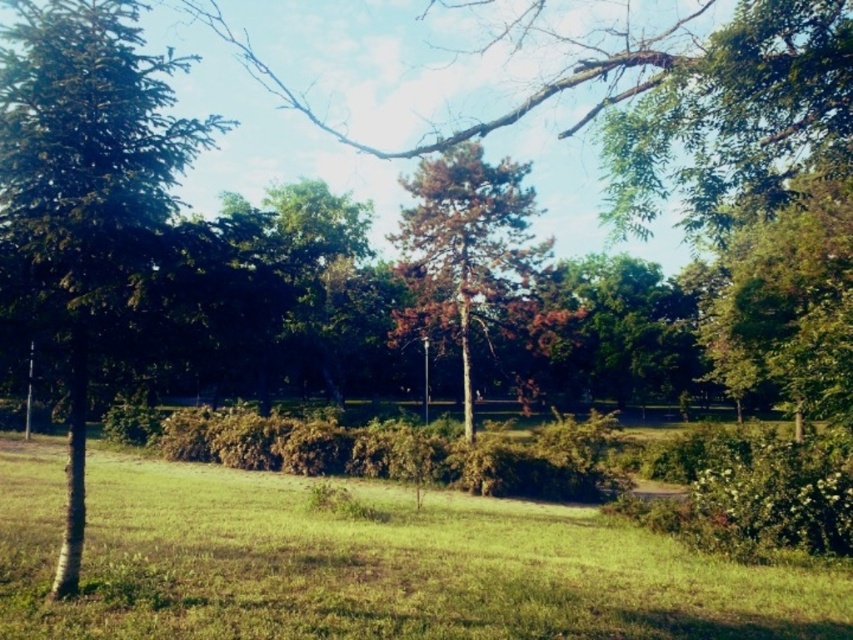
Between green grassy at lower left and green leafy tree at left, which one is positioned higher?

green leafy tree at left

Is green grassy at lower left closer to camera compared to green leafy tree at left?

No, green grassy at lower left is behind green leafy tree at left.

Image resolution: width=853 pixels, height=640 pixels. I want to click on green grassy at lower left, so [x=367, y=563].

Is point (144, 236) more distant than point (477, 209)?

No.

At what (x,y) coordinates should I click in order to perform the action: click on green leafy tree at left. Please return your answer as a coordinate pair (x, y). The width and height of the screenshot is (853, 640). Looking at the image, I should click on (86, 184).

Is green grassy at lower left below brown textured tree at center?

Correct, green grassy at lower left is located below brown textured tree at center.

In the scene shown: Is green grassy at lower left to the right of brown textured tree at center from the viewer's perspective?

In fact, green grassy at lower left is to the left of brown textured tree at center.

At what (x,y) coordinates should I click in order to perform the action: click on green grassy at lower left. Please return your answer as a coordinate pair (x, y). The width and height of the screenshot is (853, 640). Looking at the image, I should click on (367, 563).

This screenshot has width=853, height=640. What are the coordinates of `green grassy at lower left` in the screenshot? It's located at (367, 563).